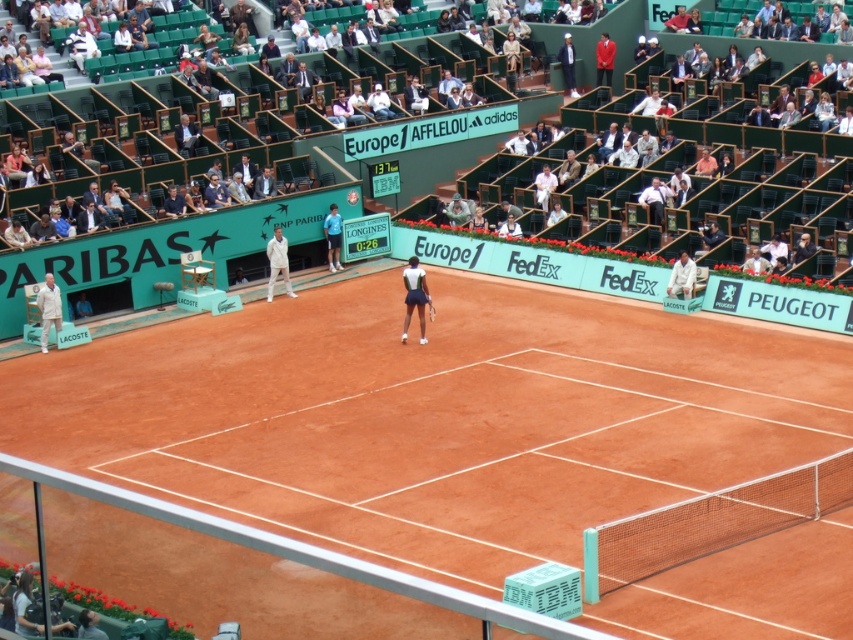
Question: Which object is closer to the camera taking this photo?

Choices:
 (A) white fabric chair at upper right
 (B) white cotton shirt at upper center

Answer: (A)

Question: Is brown clay tennis court at center wider than white clothed person at left?

Choices:
 (A) no
 (B) yes

Answer: (B)

Question: Where is brown clay tennis court at center located in relation to matte black tennis racket at center in the image?

Choices:
 (A) right
 (B) left

Answer: (A)

Question: Which point is closer to the camera taking this photo?

Choices:
 (A) (49, 314)
 (B) (415, 288)

Answer: (B)

Question: Which object appears farthest from the camera in this image?

Choices:
 (A) white fabric jacket at center
 (B) white fabric tennis racket at center
 (C) white clothed person at left
 (D) white fabric chair at upper right

Answer: (A)

Question: Does white clothed person at left have a smaller size compared to white cotton shirt at upper center?

Choices:
 (A) no
 (B) yes

Answer: (B)